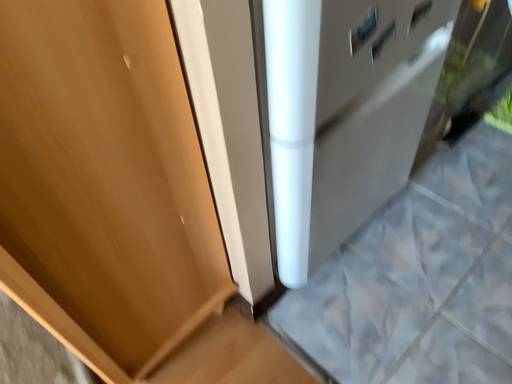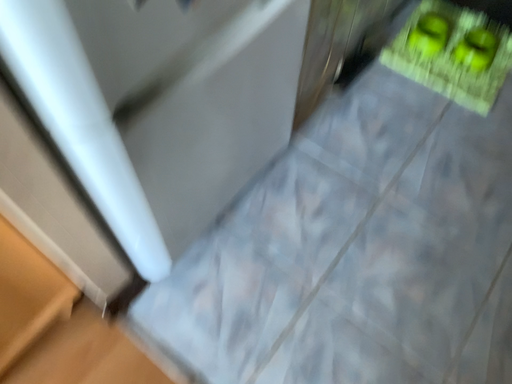
Question: Which way did the camera rotate in the video?

Choices:
 (A) rotated right
 (B) rotated left

Answer: (A)